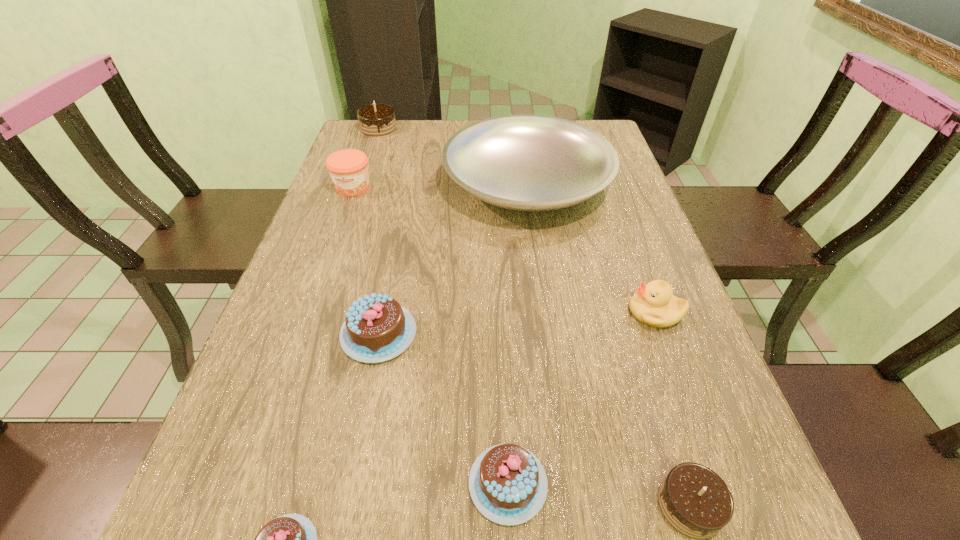
Image resolution: width=960 pixels, height=540 pixels. In the image, there is a desktop. In order to click on vacant space at the left edge in this screenshot , I will do `click(291, 309)`.

Where is `free region at the far left corner of the desktop`? free region at the far left corner of the desktop is located at coordinates [402, 125].

Where is `vacant space at the far right corner of the desktop`? The height and width of the screenshot is (540, 960). vacant space at the far right corner of the desktop is located at coordinates (604, 132).

Where is `free space that is in between the second biggest pink chocolate cake and the jam`? free space that is in between the second biggest pink chocolate cake and the jam is located at coordinates (430, 335).

Locate an element on the screen. empty space that is in between the duckling and the second farthest chocolate cake is located at coordinates (517, 323).

Identify the location of free area in between the fourth nearest chocolate cake and the bedpan. (453, 258).

This screenshot has width=960, height=540. Find the location of `vacant area that lies between the smaller chocolate chocolate cake and the duckling`. vacant area that lies between the smaller chocolate chocolate cake and the duckling is located at coordinates (672, 409).

Find the location of a particular element. The width and height of the screenshot is (960, 540). empty location between the nearer chocolate chocolate cake and the farthest pink chocolate cake is located at coordinates click(x=534, y=420).

Identify which object is located as the seventh nearest to the fourth nearest chocolate cake. Please provide its 2D coordinates. Your answer should be formatted as a tuple, i.e. [(x, y)], where the tuple contains the x and y coordinates of a point satisfying the conditions above.

[(375, 119)]

Identify which object is located as the second nearest to the right chocolate chocolate cake. Please provide its 2D coordinates. Your answer should be formatted as a tuple, i.e. [(x, y)], where the tuple contains the x and y coordinates of a point satisfying the conditions above.

[(654, 304)]